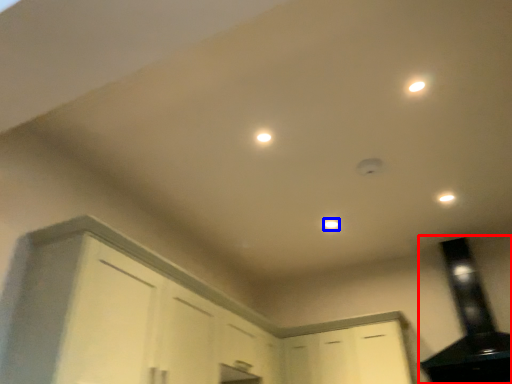
Question: Which of the following is the closest to the observer, exhaust hood (highlighted by a red box) or dot (highlighted by a blue box)?

Choices:
 (A) exhaust hood
 (B) dot

Answer: (A)